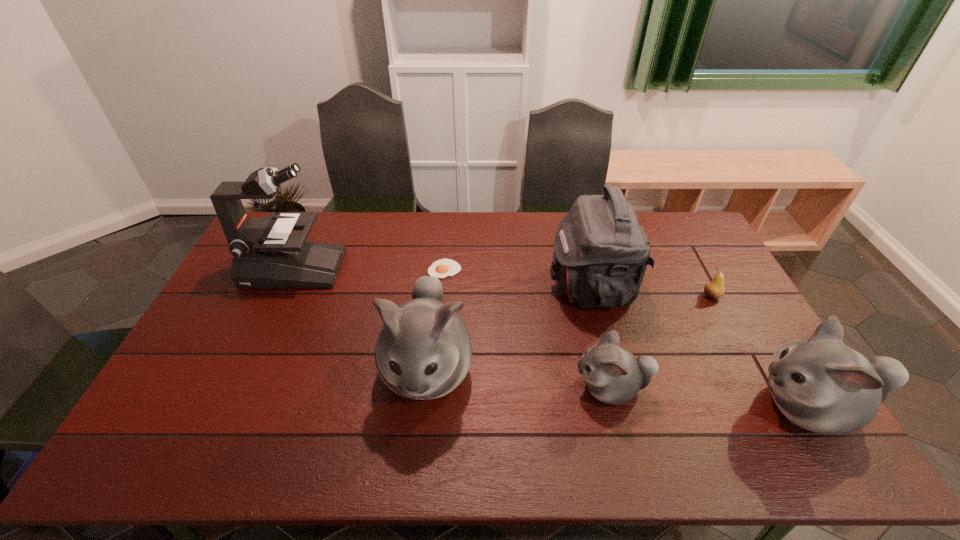
At what (x,y) coordinates should I click in order to perform the action: click on the leftmost hamster. Please return your answer as a coordinate pair (x, y). This screenshot has width=960, height=540. Looking at the image, I should click on 423,351.

Image resolution: width=960 pixels, height=540 pixels. Identify the location of the shortest hamster. (613, 375).

Find the location of a particular element. the second hamster from right to left is located at coordinates (613, 375).

This screenshot has height=540, width=960. I want to click on the rightmost hamster, so (x=822, y=385).

Where is `the fourth tallest object`? This screenshot has height=540, width=960. the fourth tallest object is located at coordinates (822, 385).

Locate an element on the screen. microscope is located at coordinates (266, 254).

Where is `the second shortest object`? the second shortest object is located at coordinates (714, 289).

I want to click on shoulder bag, so click(601, 252).

This screenshot has width=960, height=540. I want to click on the shortest object, so click(x=442, y=268).

You are a GUI agent. You are given a task and a screenshot of the screen. Output one action in this format:
    pyautogui.click(x=<x>, y=<y>)
    Task: Click on the vacant space situated on the face of the third shortest object
    The width and height of the screenshot is (960, 540).
    Given the screenshot: What is the action you would take?
    pyautogui.click(x=523, y=388)